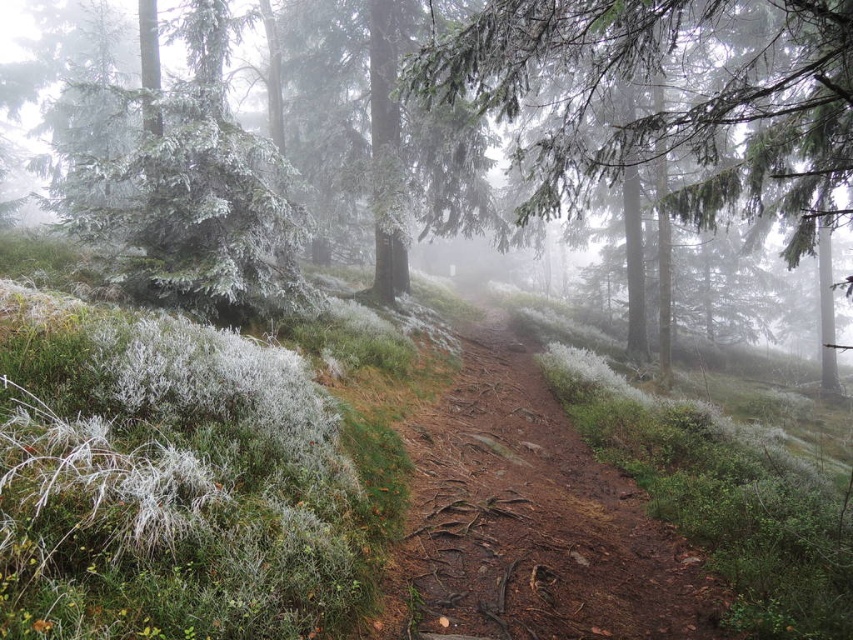
Question: Based on their relative distances, which object is nearer to the frosted evergreen tree at upper left?

Choices:
 (A) frosted evergreen tree at center
 (B) dirt path at center

Answer: (B)

Question: Estimate the real-world distances between objects in this image. Which object is farther from the frosted evergreen tree at center?

Choices:
 (A) dirt path at center
 (B) frosted evergreen tree at upper left

Answer: (A)

Question: Is frosted evergreen tree at upper left behind frosted evergreen tree at center?

Choices:
 (A) no
 (B) yes

Answer: (A)

Question: Is dirt path at center in front of frosted evergreen tree at center?

Choices:
 (A) no
 (B) yes

Answer: (B)

Question: Does dirt path at center have a greater width compared to frosted evergreen tree at upper left?

Choices:
 (A) yes
 (B) no

Answer: (B)

Question: Based on their relative distances, which object is nearer to the frosted evergreen tree at center?

Choices:
 (A) frosted evergreen tree at upper left
 (B) dirt path at center

Answer: (A)